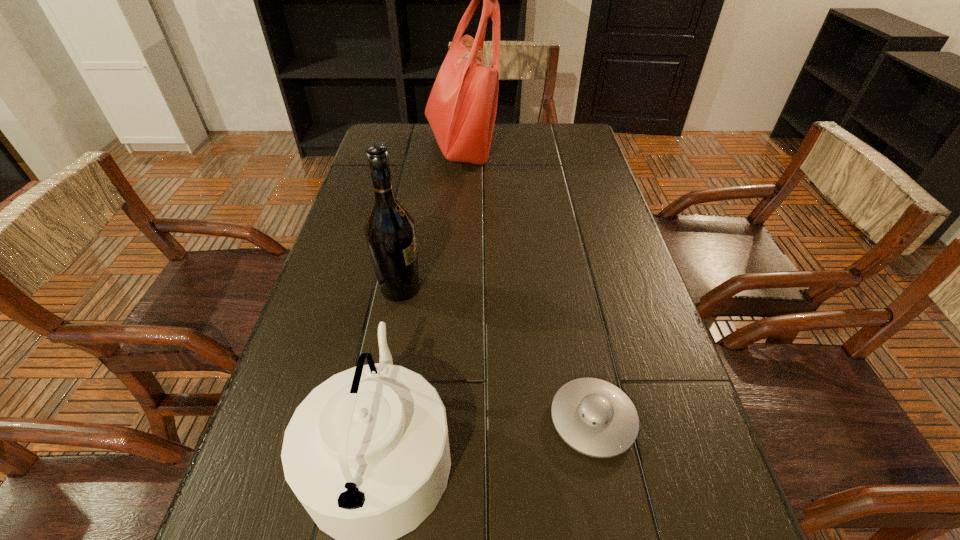
Point out which object is positioned as the second nearest to the wine bottle. Please provide its 2D coordinates. Your answer should be formatted as a tuple, i.e. [(x, y)], where the tuple contains the x and y coordinates of a point satisfying the conditions above.

[(594, 417)]

Find the location of a particular element. The width and height of the screenshot is (960, 540). the closest object to the kettle is located at coordinates (594, 417).

Find the location of a particular element. This screenshot has width=960, height=540. vacant point that satisfies the following two spatial constraints: 1. on the label of the wine bottle; 2. on the left side of the shortest object is located at coordinates (376, 420).

Where is `blank space that satisfies the following two spatial constraints: 1. on the front-facing side of the saucer; 2. on the right side of the farthest object`? blank space that satisfies the following two spatial constraints: 1. on the front-facing side of the saucer; 2. on the right side of the farthest object is located at coordinates (442, 420).

You are a GUI agent. You are given a task and a screenshot of the screen. Output one action in this format:
    pyautogui.click(x=<x>, y=<y>)
    Task: Click on the vacant region that satisfies the following two spatial constraints: 1. on the back side of the shortest object; 2. on the front-facing side of the handbag
    The height and width of the screenshot is (540, 960).
    Given the screenshot: What is the action you would take?
    pyautogui.click(x=539, y=146)

This screenshot has height=540, width=960. In order to click on vacant area in the image that satisfies the following two spatial constraints: 1. on the front-facing side of the rightmost object; 2. on the right side of the tallest object in this screenshot , I will do `click(442, 420)`.

I want to click on vacant space that satisfies the following two spatial constraints: 1. on the back side of the rightmost object; 2. on the label of the second farthest object, so click(x=567, y=289).